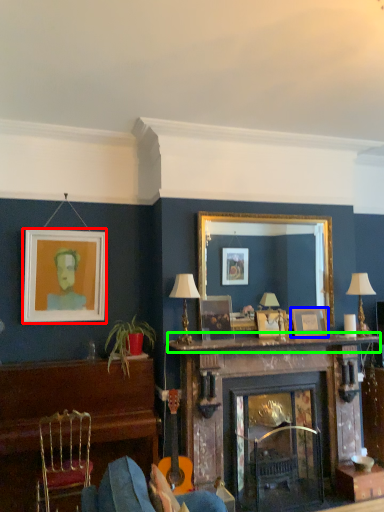
Question: Considering the real-world distances, which object is closest to picture frame (highlighted by a red box)? picture frame (highlighted by a blue box) or mantle (highlighted by a green box).

Choices:
 (A) picture frame
 (B) mantle

Answer: (B)